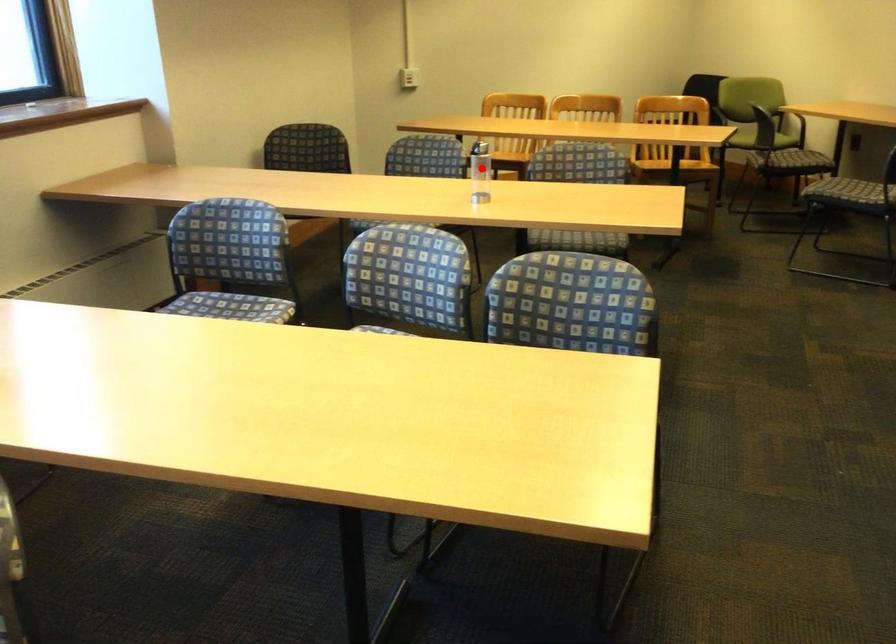
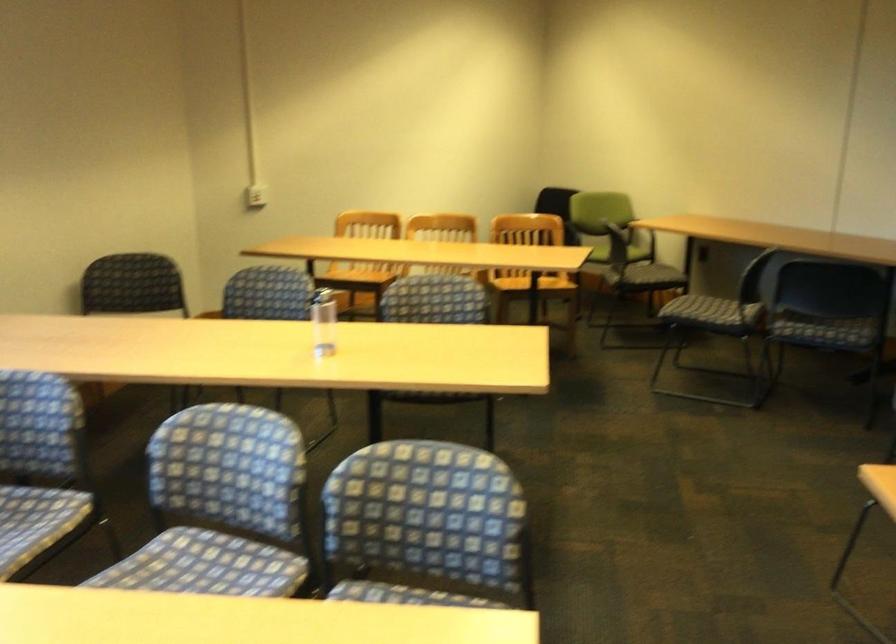
Question: I am providing you with two images of the same scene from different viewpoints. Image1 has a red point marked. In image2, the corresponding 3D location appears at what relative position? Reply with the corresponding letter.

Choices:
 (A) Closer
 (B) Farther

Answer: (A)